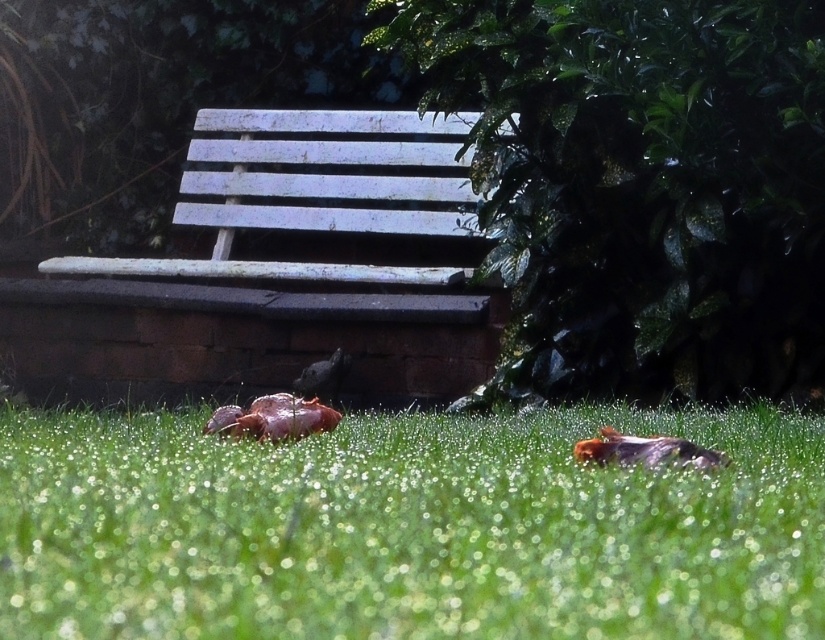
Question: Which object is farther from the camera taking this photo?

Choices:
 (A) white painted wood bench at upper center
 (B) brown speckled feathers at lower center

Answer: (A)

Question: Is green grassy at lower center bigger than shiny brown bird at center?

Choices:
 (A) yes
 (B) no

Answer: (A)

Question: Which of these objects is positioned farthest from the white painted wood bench at upper center?

Choices:
 (A) shiny brown bird at center
 (B) brown speckled feathers at lower center
 (C) green grassy at lower center

Answer: (B)

Question: From the image, what is the correct spatial relationship of white painted wood bench at upper center in relation to brown speckled feathers at lower center?

Choices:
 (A) right
 (B) left

Answer: (B)

Question: Which point is closer to the camera taking this photo?

Choices:
 (A) (303, 538)
 (B) (342, 358)
 (C) (243, 307)

Answer: (A)

Question: Where is white painted wood bench at upper center located in relation to shiny brown bird at center in the image?

Choices:
 (A) above
 (B) below

Answer: (A)